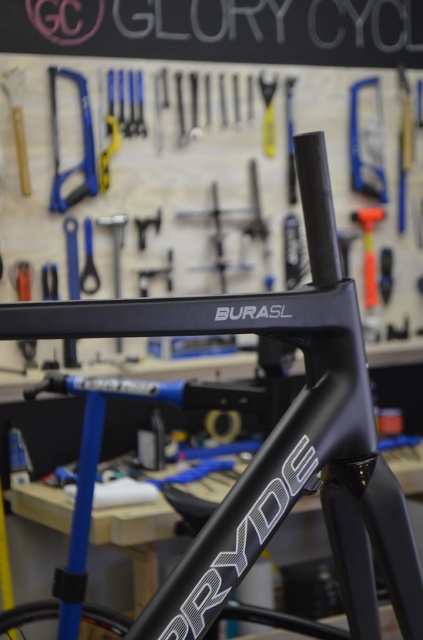
You are a mechanic working in a workshop and need to choose between the blue plastic saw at upper left and the brushed metal saw at upper left for a task that requires a wider tool. Which one should you pick?

The blue plastic saw at upper left is wider than the brushed metal saw at upper left, so you should pick the blue plastic saw at upper left for the task that requires a wider tool.

You are a bike mechanic who needs to reach the black glossy frame at center to adjust its brakes. Considering your arm can reach 24 inches, will you be able to reach it without moving closer?

The black glossy frame at center is 24.21 inches from the viewer. Since your arm can only reach 24 inches, you will need to move closer to reach it.